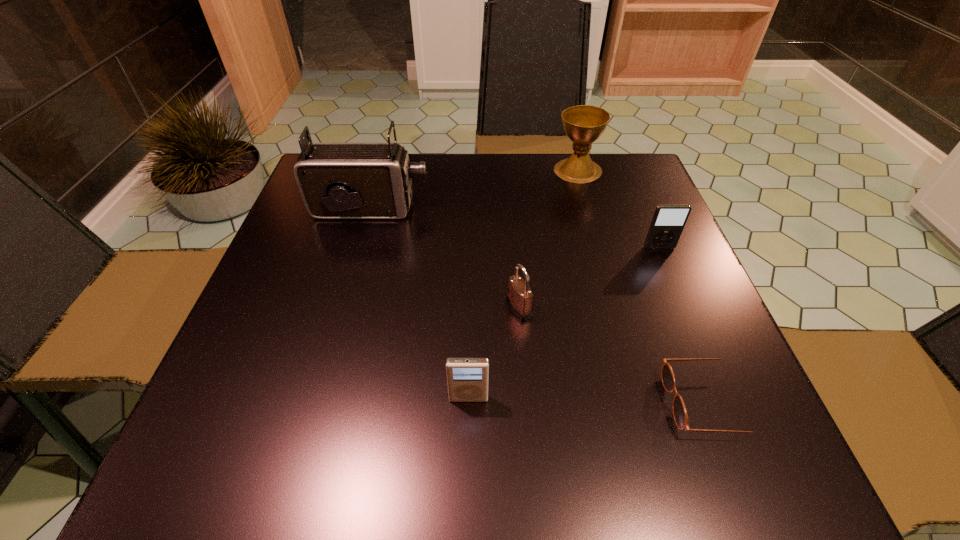
In the image, there is a desktop. In order to click on vacant region at the near edge in this screenshot , I will do `click(531, 439)`.

In the image, there is a desktop. Identify the location of vacant region at the left edge. (313, 247).

Image resolution: width=960 pixels, height=540 pixels. Find the location of `vacant space at the right edge of the desktop`. vacant space at the right edge of the desktop is located at coordinates (660, 384).

Find the location of a particular element. The height and width of the screenshot is (540, 960). free area in between the farthest object and the shortest object is located at coordinates (642, 286).

In order to click on empty space between the fifth object from right to left and the shortest object in this screenshot , I will do `click(588, 401)`.

At what (x,y) coordinates should I click in order to perform the action: click on free space between the camcorder and the farthest object. Please return your answer as a coordinate pair (x, y). This screenshot has width=960, height=540. Looking at the image, I should click on (474, 190).

I want to click on free point between the camcorder and the chalice, so click(x=474, y=190).

Identify the location of vacant area that lies between the third farthest object and the shortest object. The width and height of the screenshot is (960, 540). (684, 325).

Find the location of `blank region between the shortest object and the camcorder`. blank region between the shortest object and the camcorder is located at coordinates (540, 306).

Identify the location of blank region between the nearer iPod and the padlock. Image resolution: width=960 pixels, height=540 pixels. (493, 353).